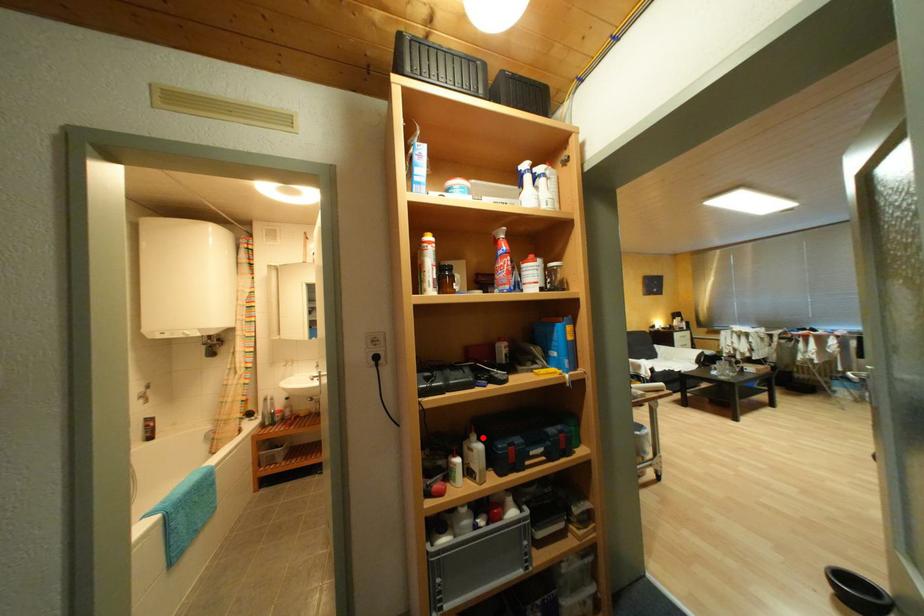
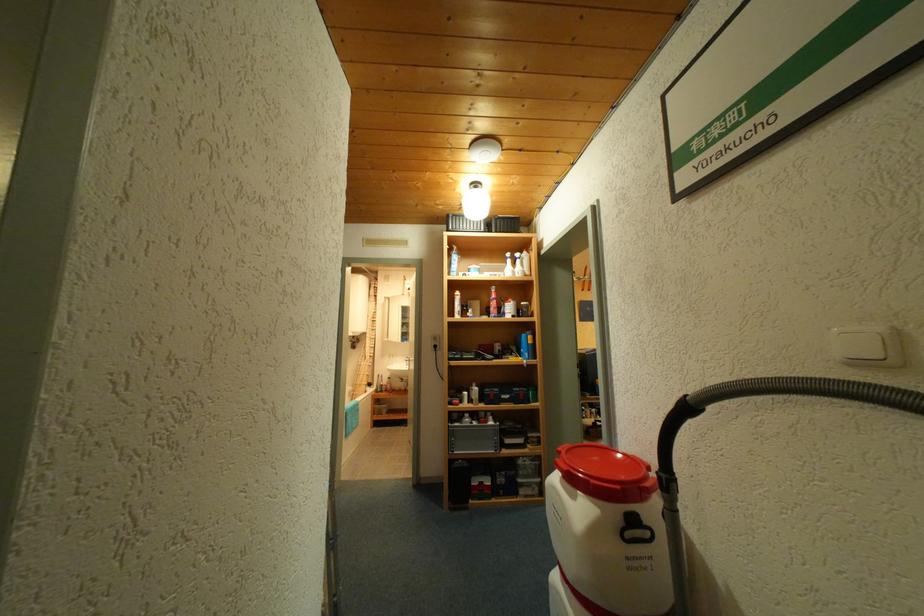
Locate, in the second image, the point that corresponds to the highlighted location in the first image.

(483, 386)